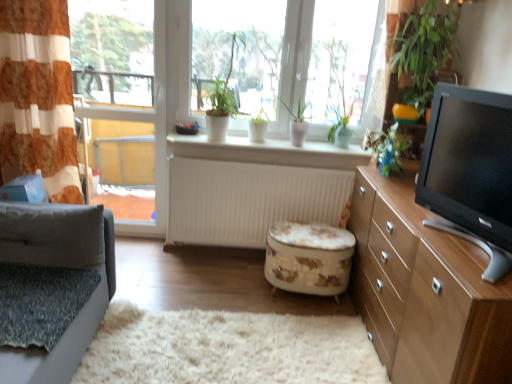
Question: Is gray fabric studio couch at left outside of green leafy plant at upper right?

Choices:
 (A) yes
 (B) no

Answer: (A)

Question: Would you say gray fabric studio couch at left is a long distance from green leafy plant at upper right?

Choices:
 (A) yes
 (B) no

Answer: (A)

Question: From a real-world perspective, is gray fabric studio couch at left located beneath green leafy plant at upper right?

Choices:
 (A) yes
 (B) no

Answer: (A)

Question: From a real-world perspective, is gray fabric studio couch at left positioned over green leafy plant at upper right based on gravity?

Choices:
 (A) no
 (B) yes

Answer: (A)

Question: Considering the relative positions of gray fabric studio couch at left and green leafy plant at upper right in the image provided, is gray fabric studio couch at left in front of green leafy plant at upper right?

Choices:
 (A) no
 (B) yes

Answer: (B)

Question: From the image's perspective, is gray fabric studio couch at left located above green leafy plant at upper right?

Choices:
 (A) no
 (B) yes

Answer: (A)

Question: Considering the relative sizes of green leafy plant at upper right and green matte plant at center, the second plant positioned from the bottom, in the image provided, is green leafy plant at upper right thinner than green matte plant at center, the second plant positioned from the bottom,?

Choices:
 (A) no
 (B) yes

Answer: (A)

Question: Considering the relative positions of green leafy plant at upper right and green matte plant at center, which is the 1th plant in left-to-right order, in the image provided, is green leafy plant at upper right to the left of green matte plant at center, which is the 1th plant in left-to-right order, from the viewer's perspective?

Choices:
 (A) yes
 (B) no

Answer: (B)

Question: Does green leafy plant at upper right have a smaller size compared to green matte plant at center, the second plant positioned from the bottom?

Choices:
 (A) yes
 (B) no

Answer: (A)

Question: Is green matte plant at center, arranged as the 2th plant when viewed from the right, surrounded by green leafy plant at upper right?

Choices:
 (A) yes
 (B) no

Answer: (B)

Question: Is green leafy plant at upper right taller than green matte plant at center, positioned as the 1th plant in top-to-bottom order?

Choices:
 (A) no
 (B) yes

Answer: (A)

Question: Is green leafy plant at upper right bigger than green matte plant at center, the second plant positioned from the bottom?

Choices:
 (A) no
 (B) yes

Answer: (A)

Question: Is green leafy plant at upper right positioned beyond the bounds of white matte radiator at center?

Choices:
 (A) no
 (B) yes

Answer: (B)